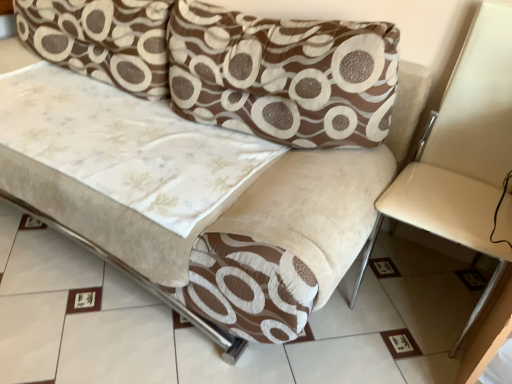
Question: Based on their positions, is brown textured pillow at upper left, arranged as the first pillow when viewed from the left, located to the left or right of brown textured pillow at upper center, which is counted as the 1th pillow, starting from the right?

Choices:
 (A) left
 (B) right

Answer: (A)

Question: Do you think brown textured pillow at upper left, the 2th pillow when ordered from right to left, is within brown textured pillow at upper center, which is the second pillow in left-to-right order, or outside of it?

Choices:
 (A) outside
 (B) inside

Answer: (A)

Question: Which object is the closest to the brown textured pillow at upper center, which is the second pillow in left-to-right order?

Choices:
 (A) beige fabric armchair at right
 (B) brown textured pillow at upper left, the 2th pillow when ordered from right to left

Answer: (B)

Question: Which object is positioned closest to the brown textured pillow at upper left, arranged as the first pillow when viewed from the left?

Choices:
 (A) brown textured pillow at upper center, which is the second pillow in left-to-right order
 (B) beige fabric armchair at right

Answer: (A)